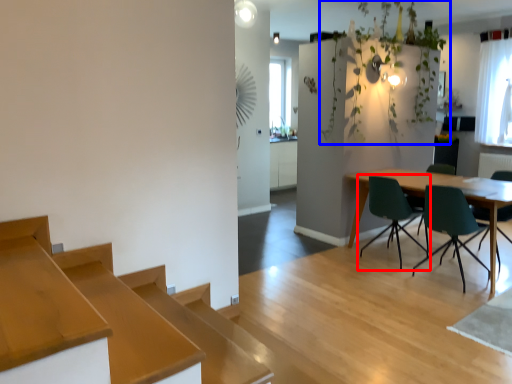
Question: Which point is further to the camera, chair (highlighted by a red box) or plant (highlighted by a blue box)?

Choices:
 (A) chair
 (B) plant

Answer: (B)